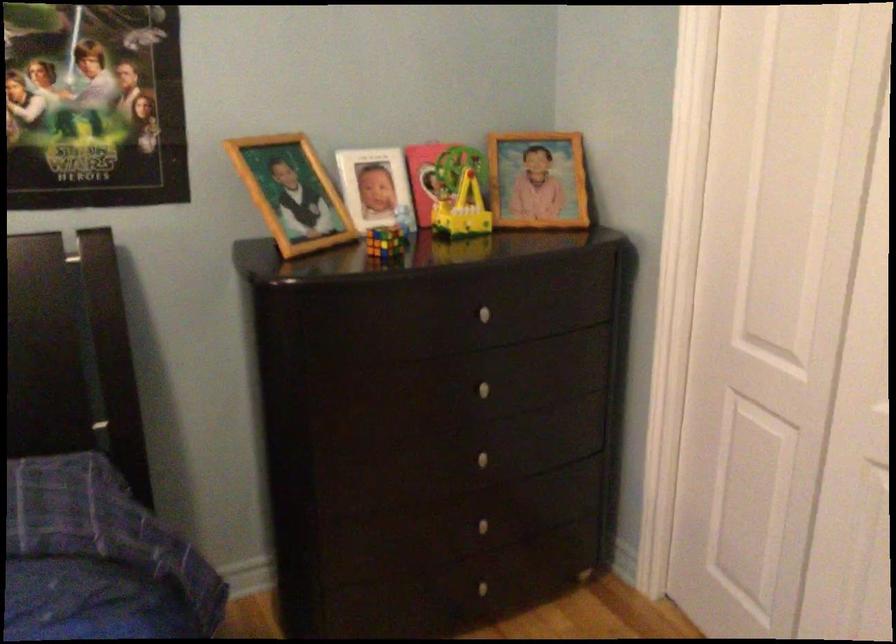
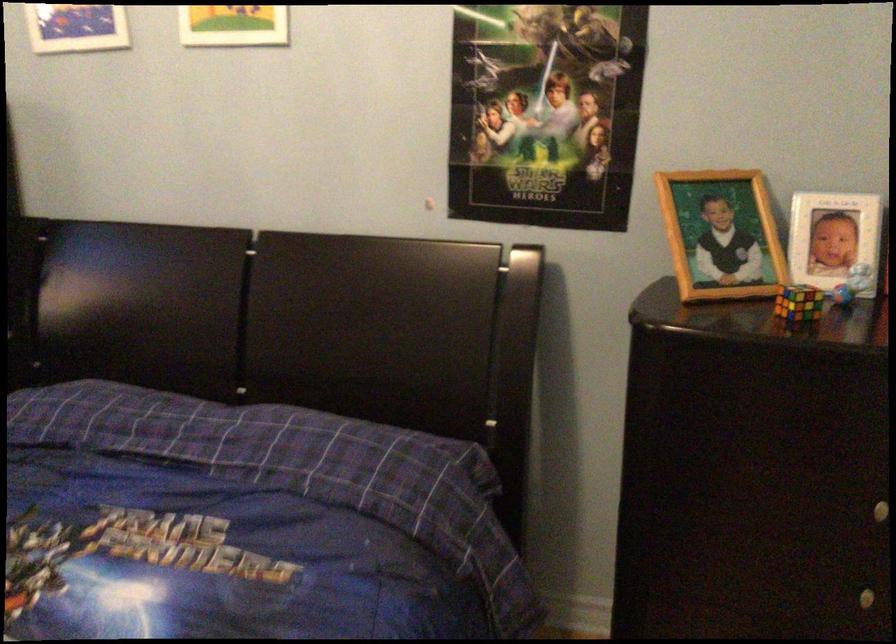
In the second image, find the point that corresponds to the point at 401,216 in the first image.

(851, 283)